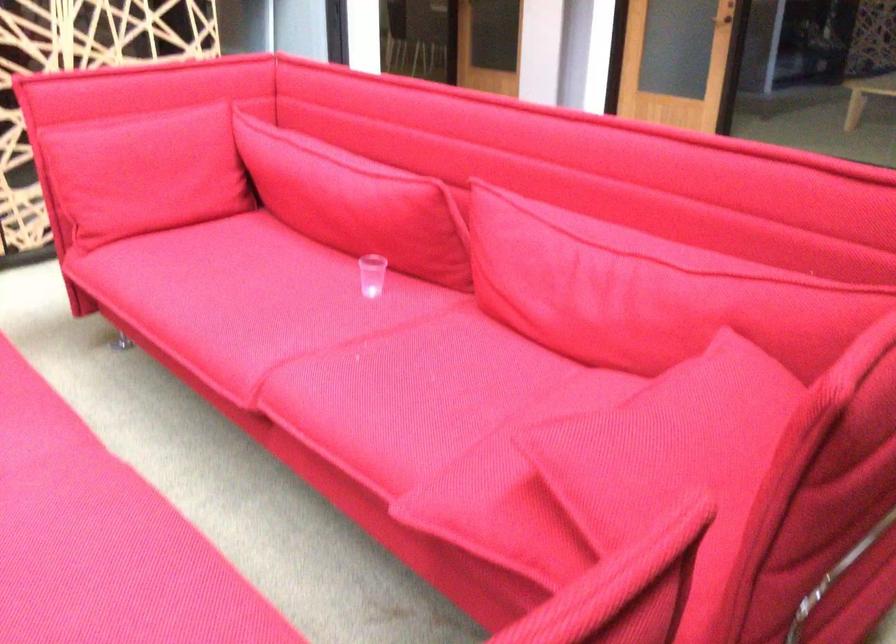
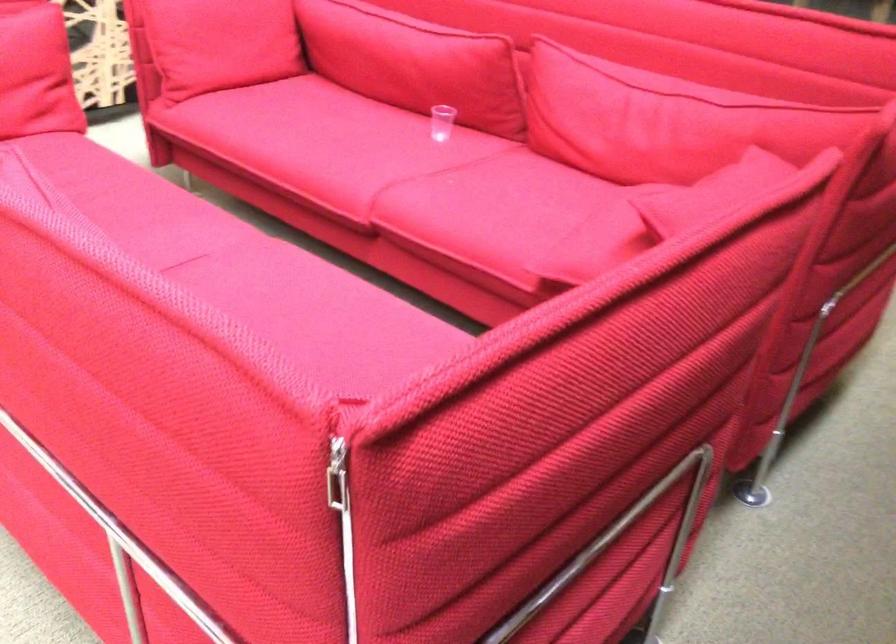
Question: The images are taken continuously from a first-person perspective. In which direction is your viewpoint rotating?

Choices:
 (A) Left
 (B) Right
 (C) Up
 (D) Down

Answer: (D)